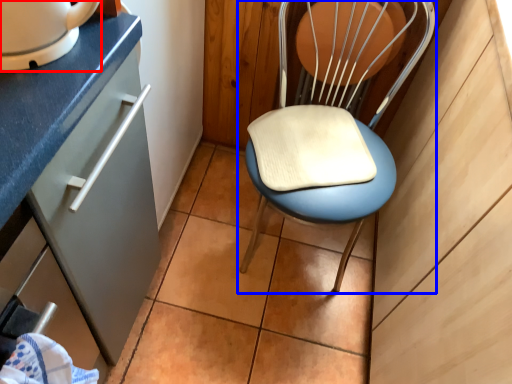
Question: Which of the following is the closest to the observer, home appliance (highlighted by a red box) or chair (highlighted by a blue box)?

Choices:
 (A) home appliance
 (B) chair

Answer: (A)